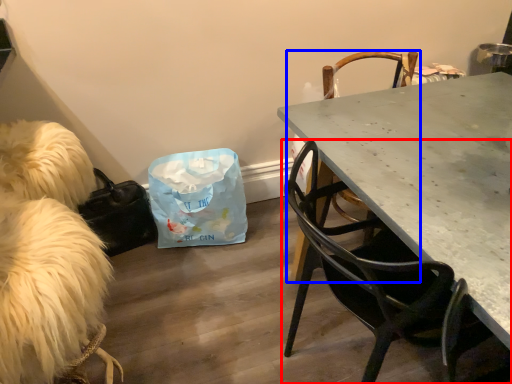
Question: Which object is closer to the camera taking this photo, chair (highlighted by a red box) or chair (highlighted by a blue box)?

Choices:
 (A) chair
 (B) chair

Answer: (A)